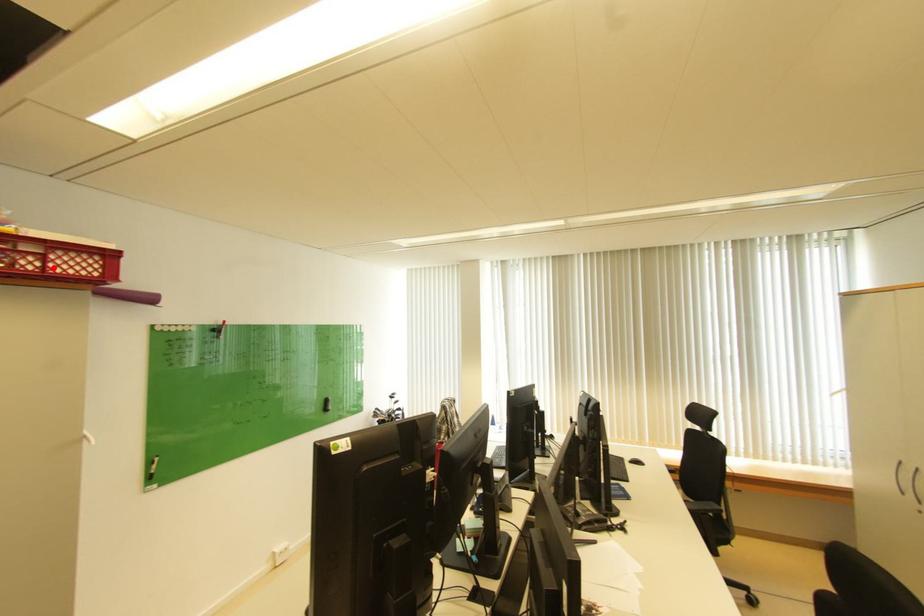
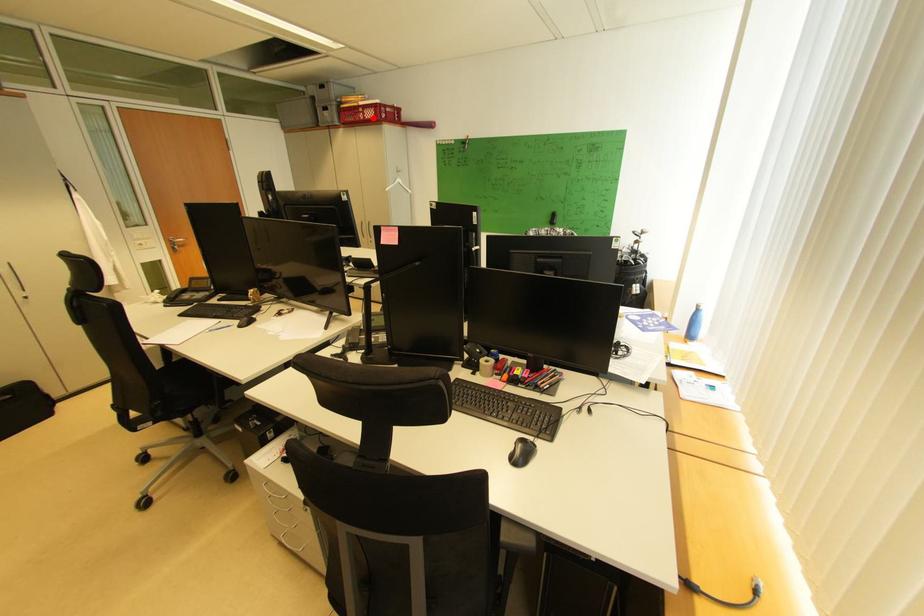
I am providing you with two images of the same scene from different viewpoints. A red point is marked on the first image and another point is marked on the second image. Does the point marked in image1 correspond to the same location as the one in image2?

Yes